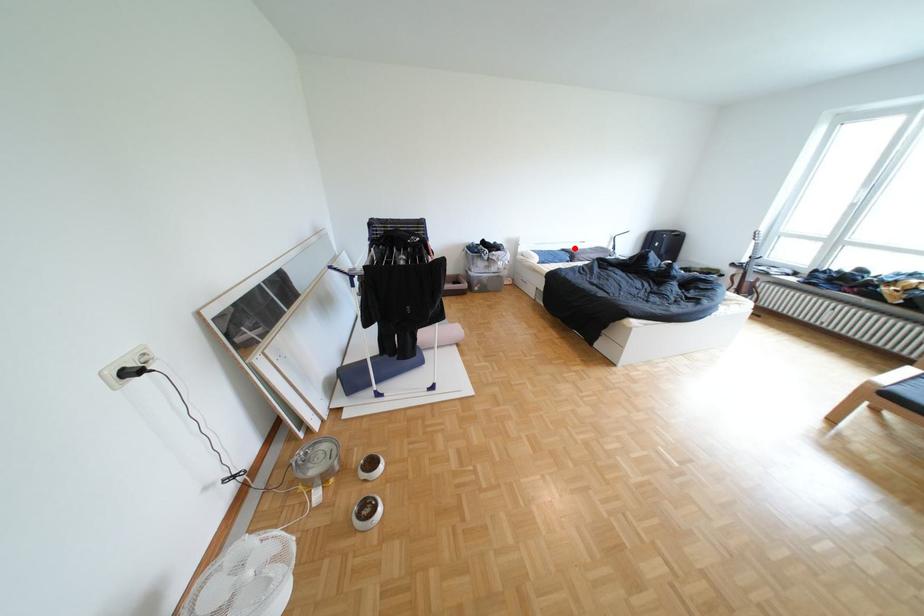
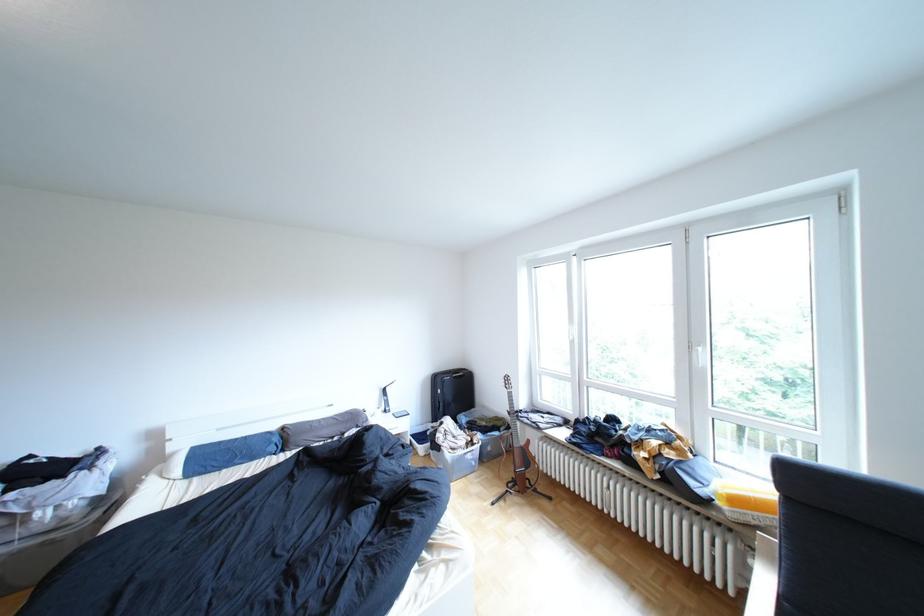
Question: A red point is marked in image1. In image2, is the corresponding 3D point closer to the camera or farther? Reply with the corresponding letter.

Choices:
 (A) The corresponding 3D point is closer.
 (B) The corresponding 3D point is farther.

Answer: (B)